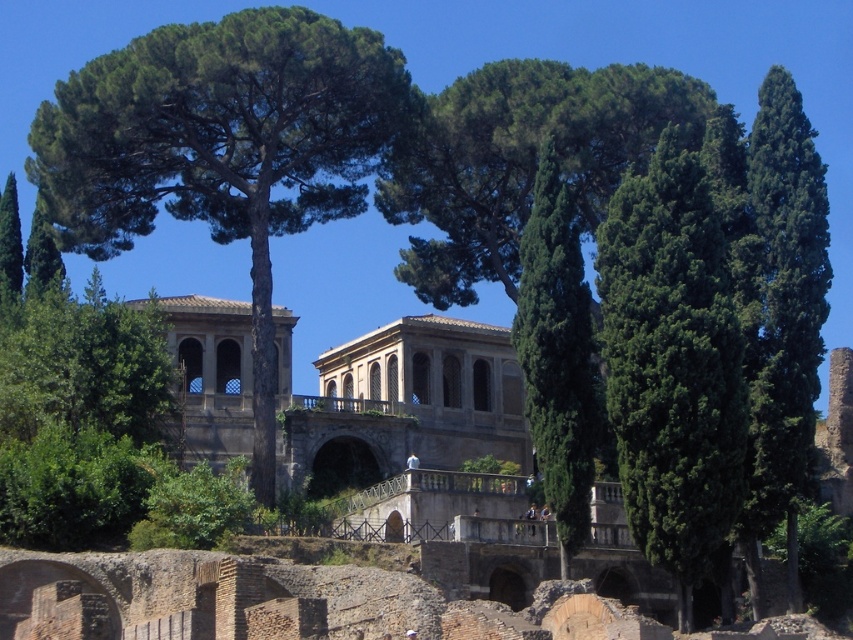
Does green leafy tree at left have a lesser width compared to green textured tree at right?

No, green leafy tree at left is not thinner than green textured tree at right.

Consider the image. Which of these two, green leafy tree at left or green textured tree at right, stands shorter?

green leafy tree at left

The width and height of the screenshot is (853, 640). Describe the element at coordinates (221, 148) in the screenshot. I see `green leafy tree at left` at that location.

Locate an element on the screen. The height and width of the screenshot is (640, 853). green leafy tree at left is located at coordinates (221, 148).

Is green leafy tree at right to the left of green textured tree at right from the viewer's perspective?

Correct, you'll find green leafy tree at right to the left of green textured tree at right.

Is point (703, 323) farther from camera compared to point (801, 365)?

No, (703, 323) is in front of (801, 365).

Where is `green leafy tree at right`? The height and width of the screenshot is (640, 853). green leafy tree at right is located at coordinates (672, 364).

Consider the image. How much distance is there between green leafy tree at left and green leafy tree at right?

green leafy tree at left and green leafy tree at right are 30.62 meters apart.

Which of these two, green leafy tree at left or green leafy tree at right, stands taller?

green leafy tree at left

Describe the element at coordinates (221, 148) in the screenshot. I see `green leafy tree at left` at that location.

This screenshot has width=853, height=640. Find the location of `green leafy tree at left`. green leafy tree at left is located at coordinates (221, 148).